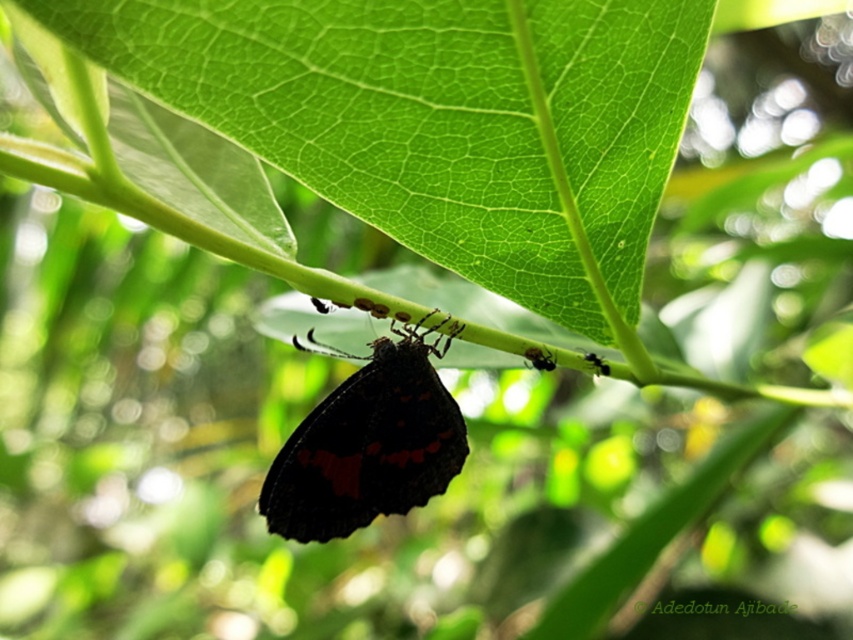
Is green matte leaf at center to the right of black matte ant at center from the viewer's perspective?

Incorrect, green matte leaf at center is not on the right side of black matte ant at center.

Does point (686, 1) lie in front of point (585, 356)?

That is True.

Image resolution: width=853 pixels, height=640 pixels. Identify the location of green matte leaf at center. (440, 120).

I want to click on green matte leaf at center, so pyautogui.click(x=440, y=120).

Can you confirm if dark matte butterfly at center is positioned above shiny black ant at center?

Actually, dark matte butterfly at center is below shiny black ant at center.

Identify the location of dark matte butterfly at center. This screenshot has height=640, width=853. (368, 442).

You are a GUI agent. You are given a task and a screenshot of the screen. Output one action in this format:
    pyautogui.click(x=<x>, y=<y>)
    Task: Click on the dark matte butterfly at center
    Image resolution: width=853 pixels, height=640 pixels.
    Given the screenshot: What is the action you would take?
    pyautogui.click(x=368, y=442)

Does green matte leaf at center have a smaller size compared to shiny black ant at center?

Actually, green matte leaf at center might be larger than shiny black ant at center.

Is point (399, 120) less distant than point (549, 362)?

Yes, it is in front of point (549, 362).

Find the location of a particular element. green matte leaf at center is located at coordinates (440, 120).

What are the coordinates of `green matte leaf at center` in the screenshot? It's located at (440, 120).